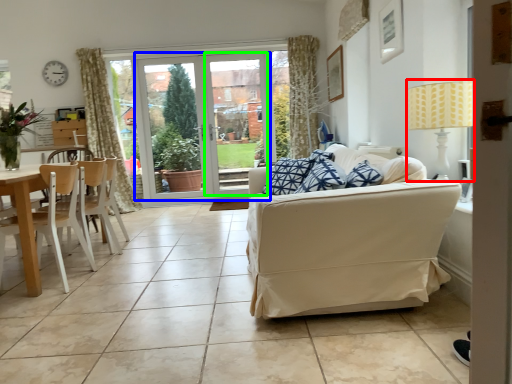
Question: Estimate the real-world distances between objects in this image. Which object is farther from lamp (highlighted by a red box), door (highlighted by a blue box) or window screen (highlighted by a green box)?

Choices:
 (A) door
 (B) window screen

Answer: (A)